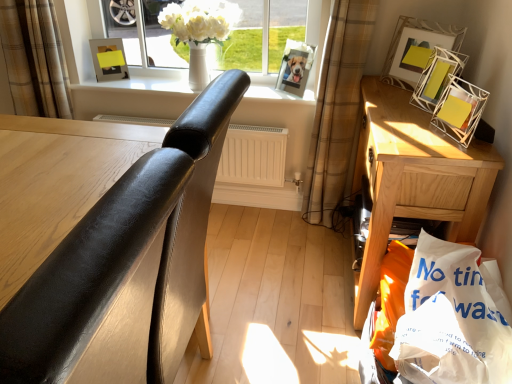
Question: From a real-world perspective, is wooden nightstand at right on black leather chair at left?

Choices:
 (A) no
 (B) yes

Answer: (A)

Question: Considering the relative sizes of wooden nightstand at right and black leather chair at left in the image provided, is wooden nightstand at right thinner than black leather chair at left?

Choices:
 (A) yes
 (B) no

Answer: (A)

Question: From a real-world perspective, is wooden nightstand at right beneath black leather chair at left?

Choices:
 (A) yes
 (B) no

Answer: (A)

Question: Is wooden nightstand at right positioned in front of black leather chair at left?

Choices:
 (A) yes
 (B) no

Answer: (B)

Question: Is wooden nightstand at right located outside black leather chair at left?

Choices:
 (A) yes
 (B) no

Answer: (A)

Question: Is metallic silver photo frame at upper center, which is counted as the 2th picture frame, starting from the left, wider or thinner than white matte radiator at center?

Choices:
 (A) thin
 (B) wide

Answer: (B)

Question: Considering the positions of metallic silver photo frame at upper center, the 3th picture frame viewed from the right, and white matte radiator at center in the image, is metallic silver photo frame at upper center, the 3th picture frame viewed from the right, taller or shorter than white matte radiator at center?

Choices:
 (A) tall
 (B) short

Answer: (B)

Question: Based on their positions, is metallic silver photo frame at upper center, which is counted as the 2th picture frame, starting from the left, located to the left or right of white matte radiator at center?

Choices:
 (A) left
 (B) right

Answer: (B)

Question: From the image's perspective, is metallic silver photo frame at upper center, which is counted as the 2th picture frame, starting from the left, positioned above or below white matte radiator at center?

Choices:
 (A) below
 (B) above

Answer: (B)

Question: Considering the positions of metallic silver picture frame at upper right, positioned as the second picture frame in right-to-left order, and wooden nightstand at right in the image, is metallic silver picture frame at upper right, positioned as the second picture frame in right-to-left order, taller or shorter than wooden nightstand at right?

Choices:
 (A) short
 (B) tall

Answer: (A)

Question: Considering the positions of metallic silver picture frame at upper right, which is counted as the 3th picture frame, starting from the left, and wooden nightstand at right in the image, is metallic silver picture frame at upper right, which is counted as the 3th picture frame, starting from the left, wider or thinner than wooden nightstand at right?

Choices:
 (A) wide
 (B) thin

Answer: (B)

Question: Is metallic silver picture frame at upper right, positioned as the second picture frame in right-to-left order, in front of or behind wooden nightstand at right in the image?

Choices:
 (A) behind
 (B) front

Answer: (A)

Question: From a real-world perspective, is metallic silver picture frame at upper right, which is counted as the 3th picture frame, starting from the left, above or below wooden nightstand at right?

Choices:
 (A) below
 (B) above

Answer: (B)

Question: Which is correct: yellow matte picture frame at upper left, acting as the 4th picture frame starting from the right, is inside wooden nightstand at right, or outside of it?

Choices:
 (A) inside
 (B) outside

Answer: (B)

Question: From a real-world perspective, is yellow matte picture frame at upper left, acting as the 4th picture frame starting from the right, physically located above or below wooden nightstand at right?

Choices:
 (A) below
 (B) above

Answer: (B)